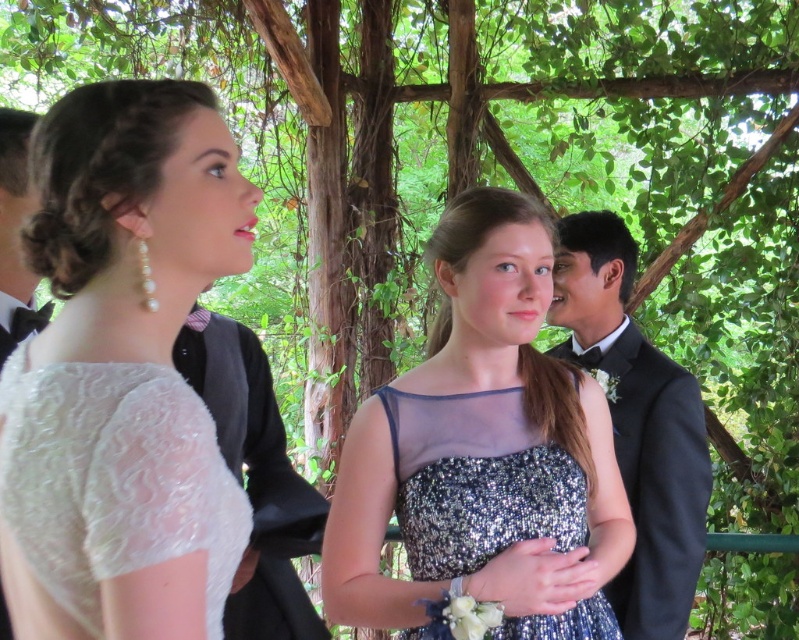
Does pearl lace dress at upper left lie in front of black satin bow tie at upper left?

That is True.

Does point (233, 250) come in front of point (34, 314)?

Yes, point (233, 250) is in front of point (34, 314).

The image size is (799, 640). I want to click on pearl lace dress at upper left, so click(x=133, y=216).

Is sparkly silver dress at center to the right of pearl lace dress at upper left from the viewer's perspective?

Correct, you'll find sparkly silver dress at center to the right of pearl lace dress at upper left.

Does sparkly silver dress at center lie in front of pearl lace dress at upper left?

That is False.

Identify the location of sparkly silver dress at center. Image resolution: width=799 pixels, height=640 pixels. (483, 452).

Find the location of a particular element. This screenshot has height=640, width=799. sparkly silver dress at center is located at coordinates (483, 452).

Between point (153, 300) and point (404, 508), which one is positioned in front?

Positioned in front is point (153, 300).

Is pearl lace dress at upper left wider than sparkly blue dress at center?

Incorrect, pearl lace dress at upper left's width does not surpass sparkly blue dress at center's.

Between point (193, 620) and point (434, 449), which one is positioned in front?

Point (193, 620) is in front.

Identify the location of pearl lace dress at upper left. The image size is (799, 640). point(133,216).